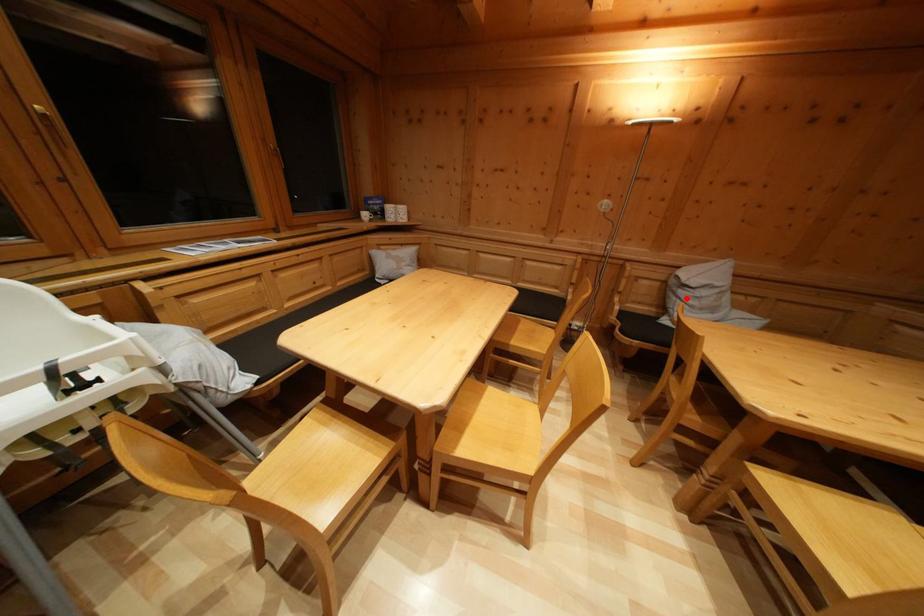
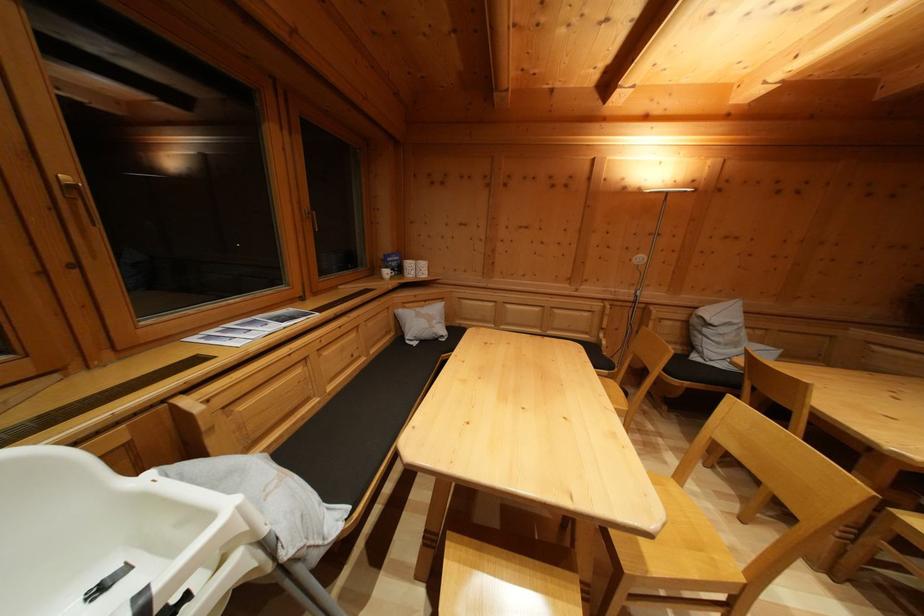
Question: I am providing you with two images of the same scene from different viewpoints. Given a red point in image1, look at the same physical point in image2. Is it:

Choices:
 (A) Closer to the viewpoint
 (B) Farther from the viewpoint

Answer: (B)